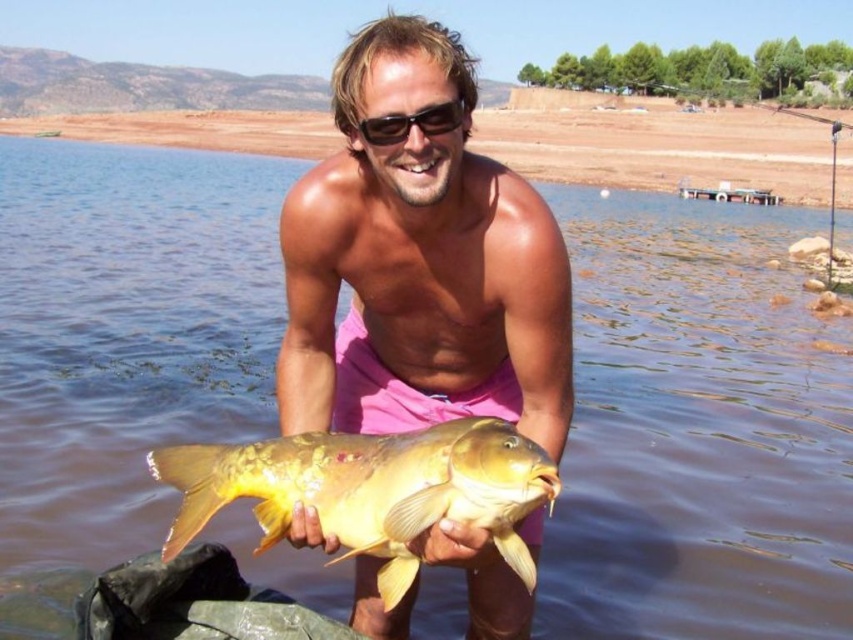
Question: Can you confirm if golden matte fish at center is bigger than black plastic sunglasses at center?

Choices:
 (A) yes
 (B) no

Answer: (A)

Question: Based on their relative distances, which object is nearer to the black plastic sunglasses at center?

Choices:
 (A) pink matte shorts at center
 (B) golden matte fish at center

Answer: (A)

Question: Which of these objects is positioned farthest from the black plastic sunglasses at center?

Choices:
 (A) golden matte fish at center
 (B) pink matte shorts at center

Answer: (A)

Question: Can you confirm if pink matte shorts at center is wider than black plastic sunglasses at center?

Choices:
 (A) yes
 (B) no

Answer: (A)

Question: Which is nearer to the black plastic sunglasses at center?

Choices:
 (A) golden matte fish at center
 (B) pink matte shorts at center

Answer: (B)

Question: Can you confirm if golden matte fish at center is positioned to the left of black plastic sunglasses at center?

Choices:
 (A) yes
 (B) no

Answer: (A)